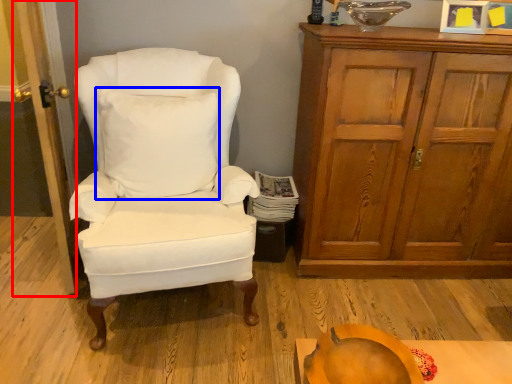
Question: Among these objects, which one is farthest to the camera, door (highlighted by a red box) or pillow (highlighted by a blue box)?

Choices:
 (A) door
 (B) pillow

Answer: (B)